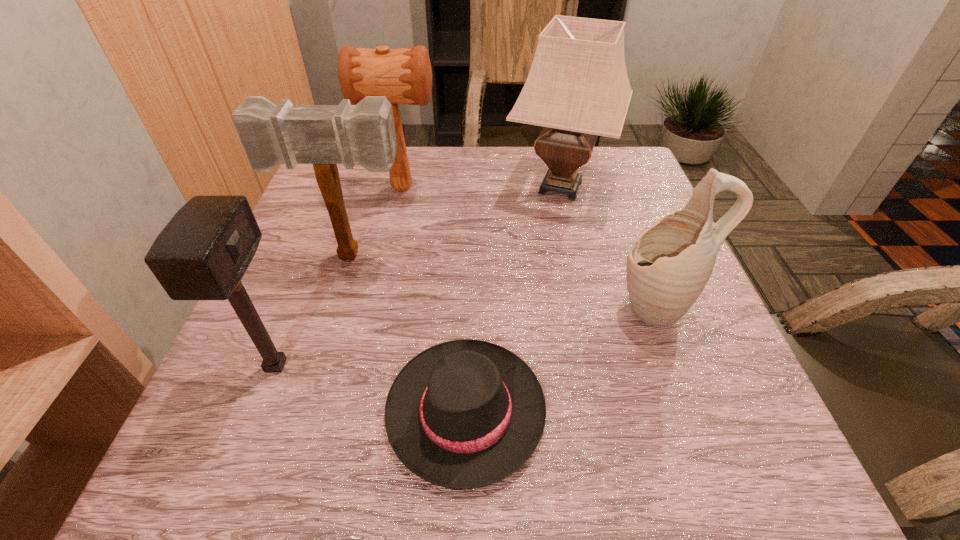
Where is `empty space between the pitcher and the shortest object`? empty space between the pitcher and the shortest object is located at coordinates (561, 359).

At what (x,y) coordinates should I click in order to perform the action: click on vacant area between the pitcher and the lampshade. Please return your answer as a coordinate pair (x, y). The image size is (960, 540). Looking at the image, I should click on (609, 247).

Identify the location of vacant area that lies between the farthest mallet and the pitcher. (529, 248).

Identify the location of vacant space that is in between the lampshade and the fourth nearest object. This screenshot has height=540, width=960. (456, 221).

You are a GUI agent. You are given a task and a screenshot of the screen. Output one action in this format:
    pyautogui.click(x=<x>, y=<y>)
    Task: Click on the blank region between the pitcher and the lampshade
    This screenshot has height=540, width=960.
    Given the screenshot: What is the action you would take?
    pyautogui.click(x=609, y=247)

Find the location of a particular element. free area in between the pitcher and the lampshade is located at coordinates (609, 247).

Where is `empty location between the dress hat and the lampshade`? This screenshot has height=540, width=960. empty location between the dress hat and the lampshade is located at coordinates (513, 299).

Point out which object is positioned as the fifth nearest to the dress hat. Please provide its 2D coordinates. Your answer should be formatted as a tuple, i.e. [(x, y)], where the tuple contains the x and y coordinates of a point satisfying the conditions above.

[(404, 76)]

Identify which object is located as the nearest to the farthest mallet. Please provide its 2D coordinates. Your answer should be formatted as a tuple, i.e. [(x, y)], where the tuple contains the x and y coordinates of a point satisfying the conditions above.

[(578, 88)]

Where is `the second closest mallet to the nearest mallet`? the second closest mallet to the nearest mallet is located at coordinates (404, 76).